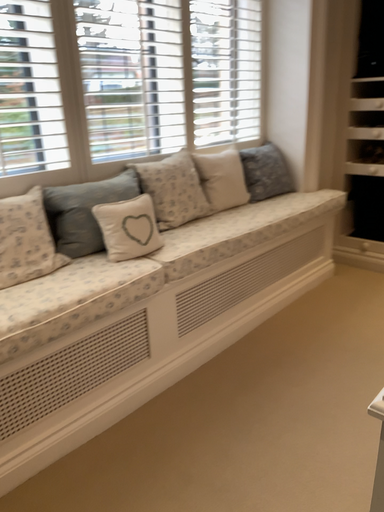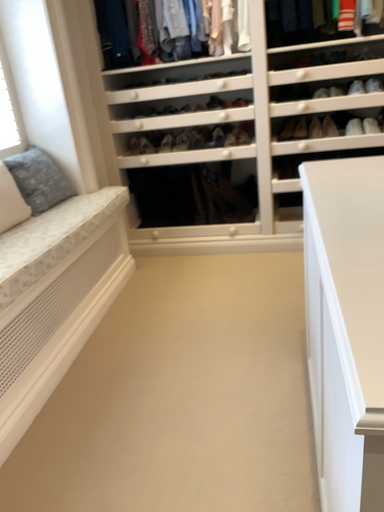
Question: Which way did the camera rotate in the video?

Choices:
 (A) rotated right
 (B) rotated left

Answer: (A)